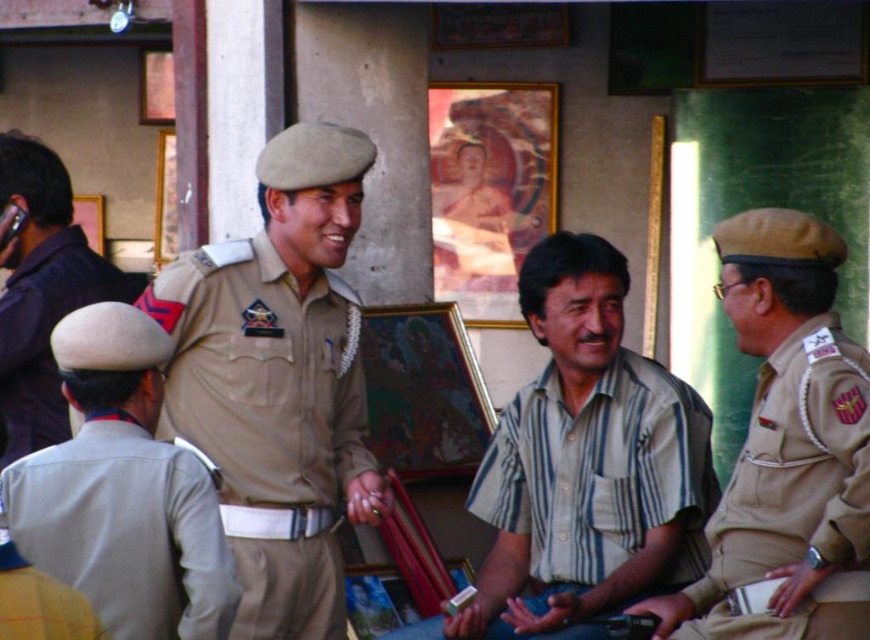
You are a photographer standing in front of the scene. You need to take a photo of both the matte khaki uniform at center and the khaki fabric uniform at left. Which one should you focus on first to ensure it is in sharp focus?

You should focus on the matte khaki uniform at center first because it is closer to you than the khaki fabric uniform at left, so it will be in focus first.